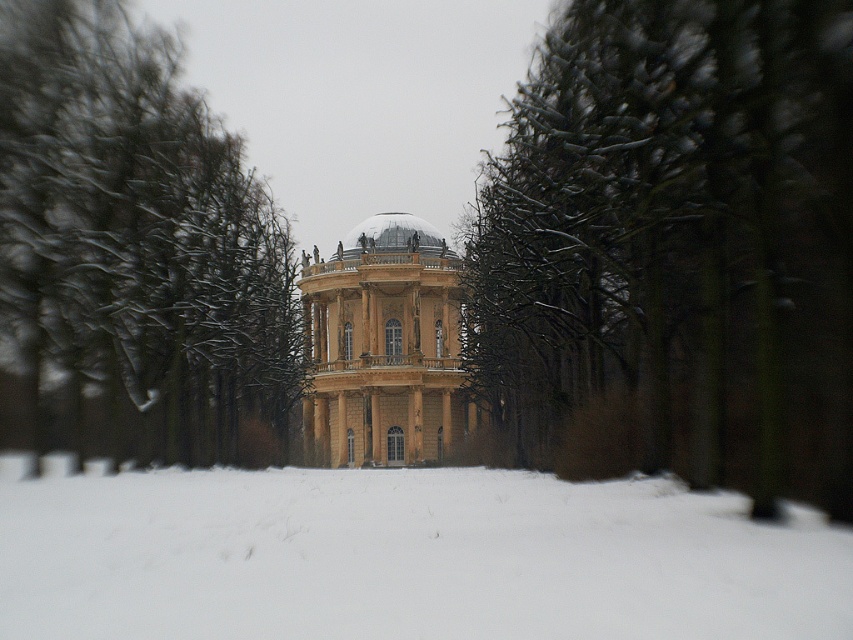
Between golden stone palace at center and shiny gold dome at center, which one has more height?

golden stone palace at center

Which of these two, golden stone palace at center or shiny gold dome at center, stands shorter?

shiny gold dome at center is shorter.

Is point (393, 376) closer to camera compared to point (387, 227)?

That is True.

Where is `golden stone palace at center`? golden stone palace at center is located at coordinates (386, 349).

Find the location of `white fluffy snow at lower center`. white fluffy snow at lower center is located at coordinates (405, 556).

Identify the location of white fluffy snow at lower center. This screenshot has height=640, width=853. (405, 556).

Where is `white fluffy snow at lower center`? The width and height of the screenshot is (853, 640). white fluffy snow at lower center is located at coordinates (405, 556).

Can you confirm if snow-covered branches at center is positioned above shiny gold dome at center?

No, snow-covered branches at center is not above shiny gold dome at center.

Is point (628, 326) less distant than point (440, 250)?

Yes, it is.

Is point (509, 378) closer to camera compared to point (436, 250)?

Yes, it is in front of point (436, 250).

The height and width of the screenshot is (640, 853). I want to click on snow-covered branches at center, so click(x=672, y=250).